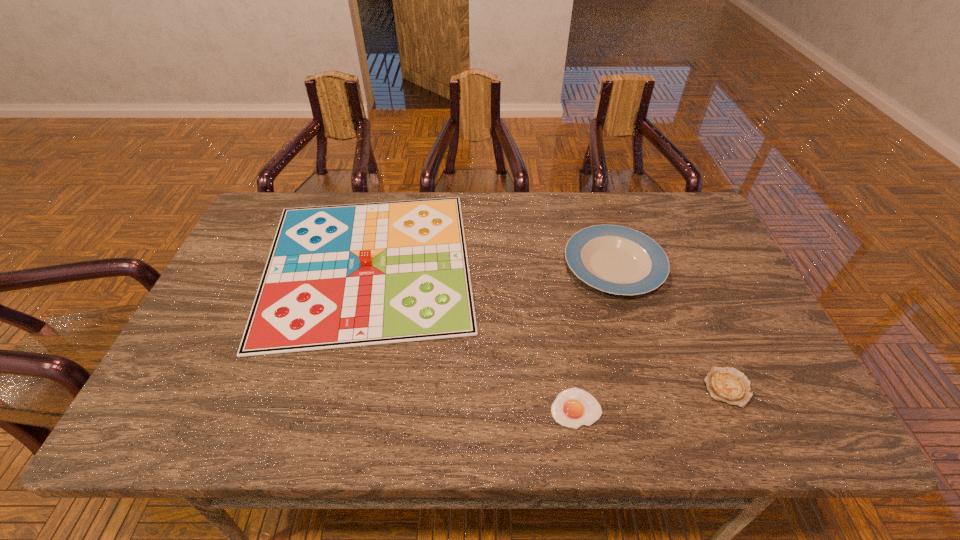
The image size is (960, 540). In order to click on vacant space at the right edge of the desktop in this screenshot , I will do `click(684, 251)`.

At what (x,y) coordinates should I click in order to perform the action: click on vacant area at the far left corner. Please return your answer as a coordinate pair (x, y). This screenshot has height=540, width=960. Looking at the image, I should click on (273, 195).

This screenshot has height=540, width=960. In order to click on vacant space at the near left corner of the desktop in this screenshot , I will do `click(197, 414)`.

The image size is (960, 540). What are the coordinates of `free space at the far right corner of the desktop` in the screenshot? It's located at (671, 202).

Identify the location of free space between the gameboard and the third shortest object. [x=491, y=265].

Where is `free area in between the shortest object and the second shortest object`? This screenshot has width=960, height=540. free area in between the shortest object and the second shortest object is located at coordinates (652, 398).

Identify the location of free space between the gameboard and the plate. The width and height of the screenshot is (960, 540). pos(491,265).

At what (x,y) coordinates should I click in order to perform the action: click on free space between the gameboard and the shortest object. Please return your answer as a coordinate pair (x, y). The height and width of the screenshot is (540, 960). Looking at the image, I should click on (471, 336).

Locate an element on the screen. This screenshot has height=540, width=960. empty space that is in between the leftmost object and the egg yolk is located at coordinates (471, 336).

Identify the location of free space between the third shortest object and the quiche. The height and width of the screenshot is (540, 960). (671, 327).